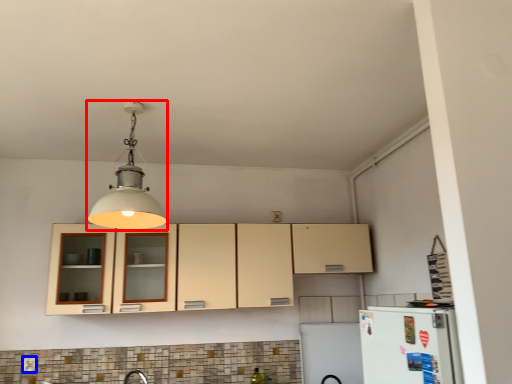
Question: Which object is closer to the camera taking this photo, light fixture (highlighted by a red box) or electric outlet (highlighted by a blue box)?

Choices:
 (A) light fixture
 (B) electric outlet

Answer: (A)